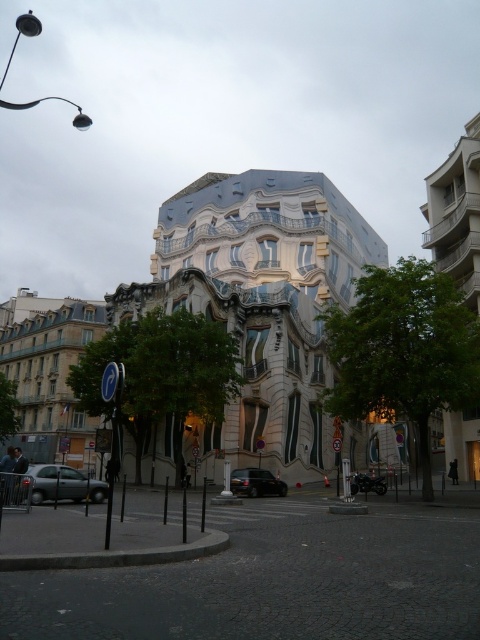
You are standing on the cobblestone street in front of the modern building. You see a point marked at coordinate (x=62, y=484). Which object is this point located on?

The point at coordinate (x=62, y=484) is located on the silver metallic car at lower left.

You are a delivery driver trying to park your vehicle in the space between the silver metallic car at lower left and the shiny black car at center. The parking spot can accommodate vehicles up to 4.5 meters in length. Can both cars fit in the space if they are parked side by side?

The silver metallic car at lower left is bigger than the shiny black car at center. However, without knowing their exact lengths, it is impossible to determine if they can fit in the 4.5 meter parking space when parked side by side.

You are driving a car that is 5 meters long and want to park it between the silver metallic car at lower left and the shiny black car at center. Is there enough space between them to park your car?

The distance between the silver metallic car at lower left and the shiny black car at center is 16.53 meters. Since your car is only 5 meters long, there is sufficient space to park between them.